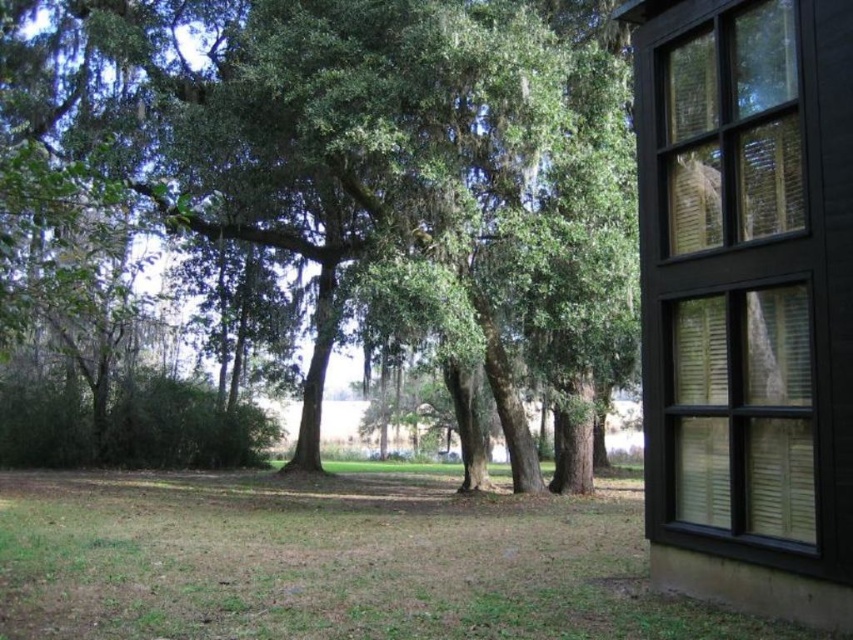
You are standing inside the building looking through the large window. You see the green leafy tree at center and the green grass at lower center. Which object is closer to you?

The green leafy tree at center is closer to you because it is in front of the green grass at lower center.

You are an interior designer planning to install a new window. You have a design that requires the window to be wider than the green grass at lower center. Based on the scene, can the black wooden window at right accommodate this requirement?

The black wooden window at right has a lesser width compared to green grass at lower center, so it cannot accommodate the requirement as it is narrower than the grass area.